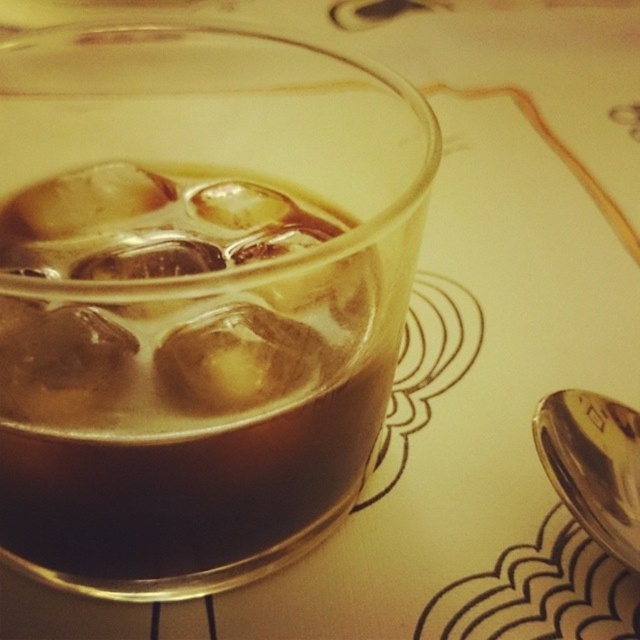
Question: Is translucent glass beverage at center wider than silver/metallic spoon at lower right?

Choices:
 (A) yes
 (B) no

Answer: (A)

Question: Which point is closer to the camera?

Choices:
 (A) (52, 529)
 (B) (593, 444)

Answer: (A)

Question: Which object appears farthest from the camera in this image?

Choices:
 (A) translucent glass beverage at center
 (B) silver/metallic spoon at lower right

Answer: (B)

Question: Can you confirm if translucent glass beverage at center is smaller than silver/metallic spoon at lower right?

Choices:
 (A) no
 (B) yes

Answer: (A)

Question: Does translucent glass beverage at center appear on the right side of silver/metallic spoon at lower right?

Choices:
 (A) no
 (B) yes

Answer: (A)